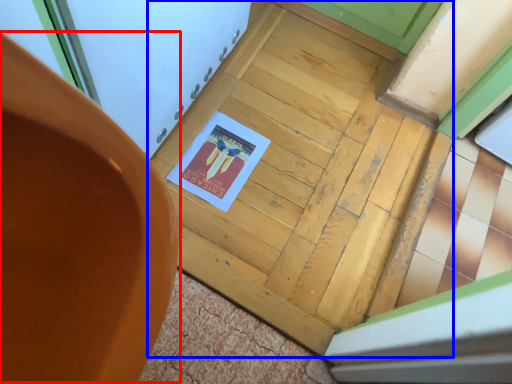
Question: Which of the following is the closest to the observer, chair (highlighted by a red box) or door (highlighted by a blue box)?

Choices:
 (A) chair
 (B) door

Answer: (A)